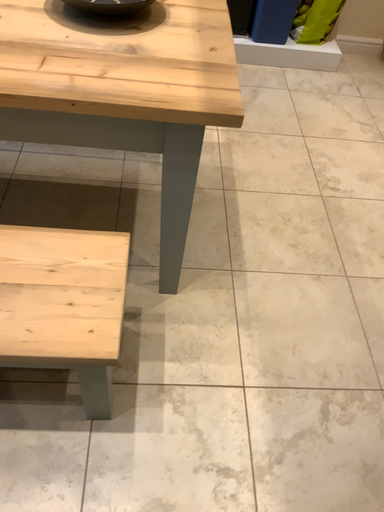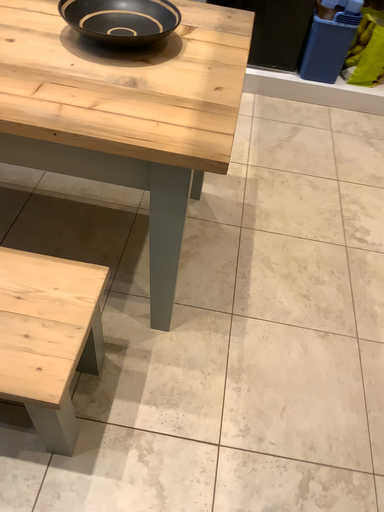
Question: Which way did the camera rotate in the video?

Choices:
 (A) rotated left
 (B) rotated right

Answer: (A)